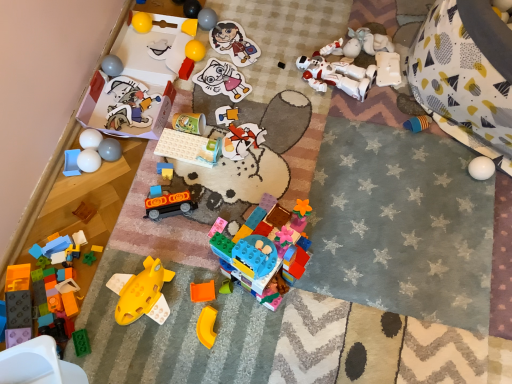
What are the coordinates of `vacant space that's between yellow matte block at center, which appears as the 13th toy when viewed from the right, and black plastic train at center, the 14th toy from the right` in the screenshot? It's located at (176, 122).